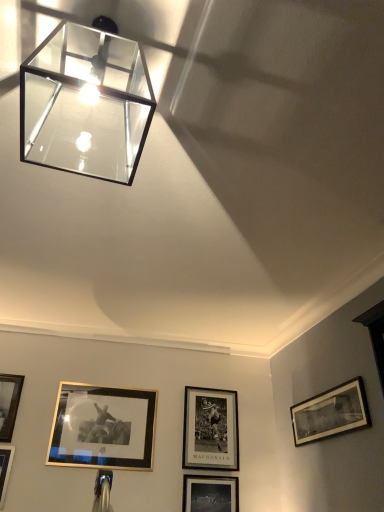
Question: Is the position of clear glass cube at upper left less distant than that of matte black picture frame at lower center, the third picture frame viewed from the right?

Choices:
 (A) yes
 (B) no

Answer: (A)

Question: From the image's perspective, is clear glass cube at upper left on top of matte black picture frame at lower center, which is counted as the 3th picture frame, starting from the left?

Choices:
 (A) yes
 (B) no

Answer: (A)

Question: Would you say clear glass cube at upper left contains matte black picture frame at lower center, the third picture frame viewed from the right?

Choices:
 (A) no
 (B) yes

Answer: (A)

Question: From the image's perspective, does clear glass cube at upper left appear lower than matte black picture frame at lower center, the third picture frame viewed from the right?

Choices:
 (A) yes
 (B) no

Answer: (B)

Question: Is clear glass cube at upper left to the left of matte black picture frame at lower center, which is counted as the 3th picture frame, starting from the left, from the viewer's perspective?

Choices:
 (A) no
 (B) yes

Answer: (B)

Question: Is clear glass cube at upper left shorter than matte black picture frame at lower center, the third picture frame viewed from the right?

Choices:
 (A) yes
 (B) no

Answer: (B)

Question: Can you confirm if black matte picture frame at lower right, which is the 1th picture frame from right to left, is wider than black matte picture frame at center, placed as the second picture frame when sorted from right to left?

Choices:
 (A) yes
 (B) no

Answer: (A)

Question: Is black matte picture frame at lower right, which is the 1th picture frame from right to left, positioned with its back to black matte picture frame at center, placed as the second picture frame when sorted from right to left?

Choices:
 (A) no
 (B) yes

Answer: (A)

Question: Is black matte picture frame at lower right, the 5th picture frame in the left-to-right sequence, next to black matte picture frame at center, placed as the second picture frame when sorted from right to left?

Choices:
 (A) no
 (B) yes

Answer: (A)

Question: Does black matte picture frame at lower right, which is the 1th picture frame from right to left, have a greater height compared to black matte picture frame at center, placed as the second picture frame when sorted from right to left?

Choices:
 (A) yes
 (B) no

Answer: (B)

Question: Considering the relative sizes of black matte picture frame at lower right, the 5th picture frame in the left-to-right sequence, and black matte picture frame at center, placed as the second picture frame when sorted from right to left, in the image provided, is black matte picture frame at lower right, the 5th picture frame in the left-to-right sequence, thinner than black matte picture frame at center, placed as the second picture frame when sorted from right to left,?

Choices:
 (A) yes
 (B) no

Answer: (B)

Question: Considering the relative positions of black matte picture frame at lower right, which is the 1th picture frame from right to left, and black matte picture frame at center, placed as the second picture frame when sorted from right to left, in the image provided, is black matte picture frame at lower right, which is the 1th picture frame from right to left, in front of black matte picture frame at center, placed as the second picture frame when sorted from right to left,?

Choices:
 (A) no
 (B) yes

Answer: (B)

Question: From the image's perspective, does black matte picture frame at lower right, the 5th picture frame in the left-to-right sequence, appear higher than gold-framed picture at lower left, which is the 5th picture frame from right to left?

Choices:
 (A) yes
 (B) no

Answer: (A)